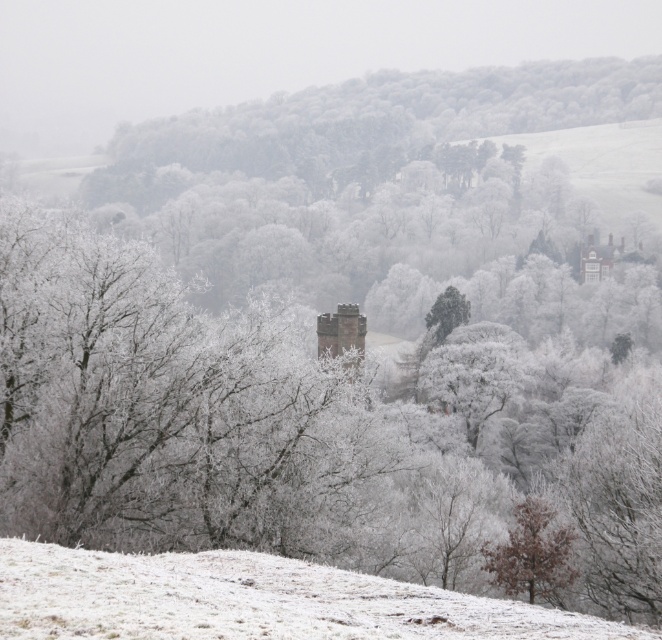
Question: Which of these objects is positioned closest to the brown textured tree at lower right?

Choices:
 (A) frosted branches at center
 (B) brown stone chimney at center
 (C) green textured tree at center

Answer: (A)

Question: Which object is the farthest from the brown textured tree at lower right?

Choices:
 (A) frosted branches at center
 (B) green textured tree at center

Answer: (B)

Question: Is snowy grass at lower left positioned in front of green textured tree at center?

Choices:
 (A) no
 (B) yes

Answer: (B)

Question: Where is frosted white trees at center located in relation to green textured tree at center in the image?

Choices:
 (A) above
 (B) below

Answer: (A)

Question: Can you confirm if frosted branches at center is smaller than brown stone chimney at center?

Choices:
 (A) no
 (B) yes

Answer: (A)

Question: Which of the following is the closest to the observer?

Choices:
 (A) snowy grass at lower left
 (B) frosted white trees at center
 (C) frosted branches at center
 (D) brown stone chimney at center

Answer: (A)